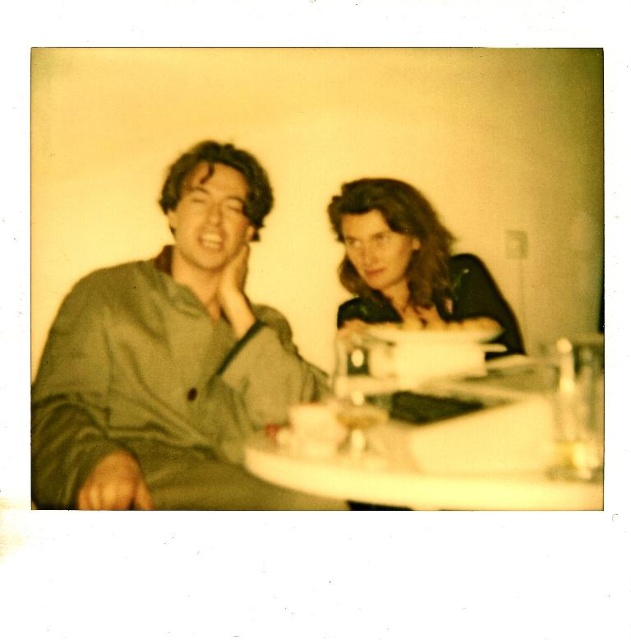
Who is shorter, green matte shirt at left or white glossy table at center?

With less height is white glossy table at center.

What do you see at coordinates (170, 362) in the screenshot?
I see `green matte shirt at left` at bounding box center [170, 362].

Where is `green matte shirt at left`? green matte shirt at left is located at coordinates (170, 362).

Is point (114, 410) in front of point (391, 209)?

Yes, it is.

Is point (191, 221) positioned before point (459, 304)?

Yes, point (191, 221) is in front of point (459, 304).

Identify the location of green matte shirt at left. The image size is (631, 640). (170, 362).

Who is taller, white glossy table at center or matte black shirt at center?

Standing taller between the two is matte black shirt at center.

Describe the element at coordinates (451, 449) in the screenshot. The width and height of the screenshot is (631, 640). I see `white glossy table at center` at that location.

The image size is (631, 640). I want to click on white glossy table at center, so click(x=451, y=449).